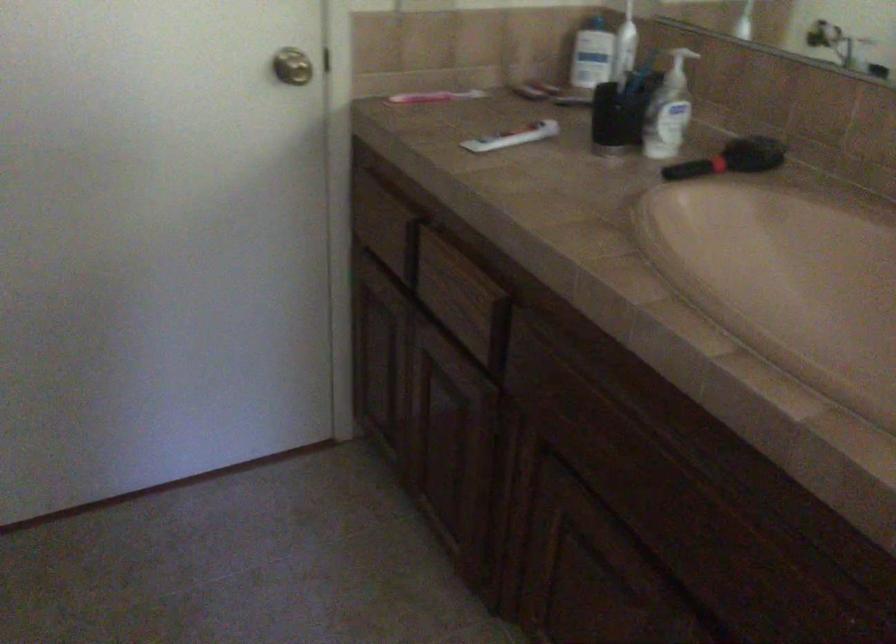
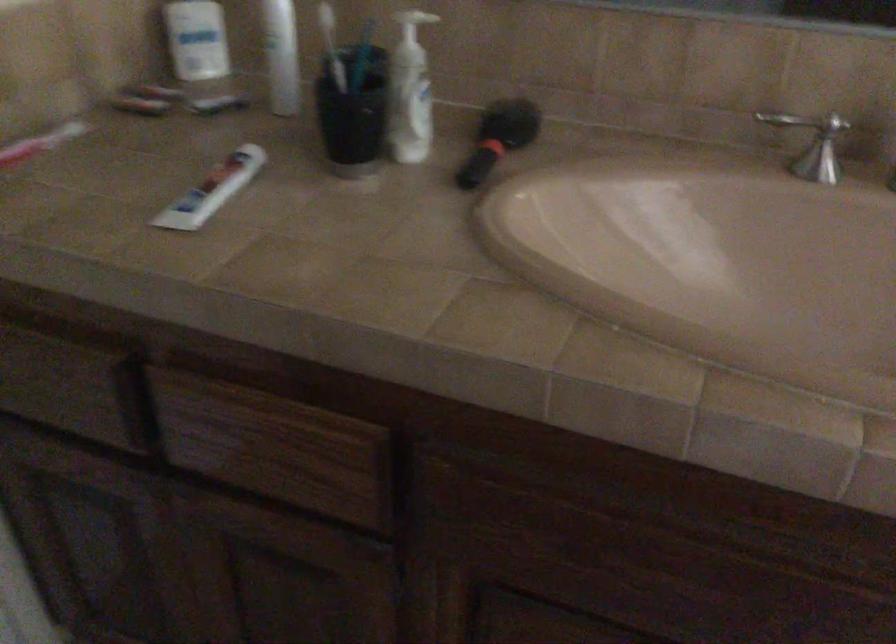
In the second image, find the point that corresponds to [728,156] in the first image.

(498, 138)